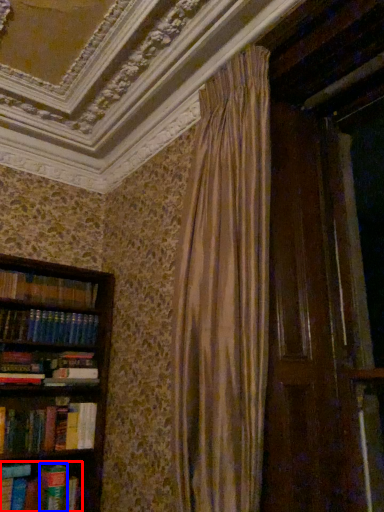
Question: Which point is further to the camera, book (highlighted by a red box) or paperback book (highlighted by a blue box)?

Choices:
 (A) book
 (B) paperback book

Answer: (B)